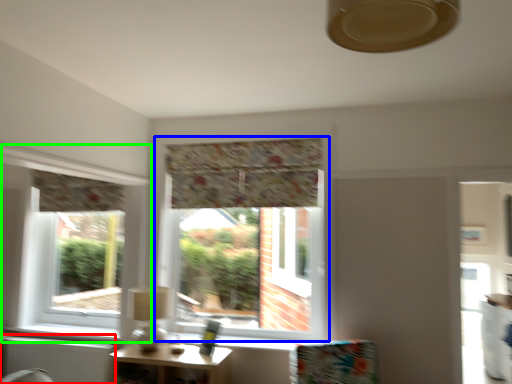
Question: Which is farther away from radiator (highlighted by a red box)? window (highlighted by a blue box) or window (highlighted by a green box)?

Choices:
 (A) window
 (B) window

Answer: (A)